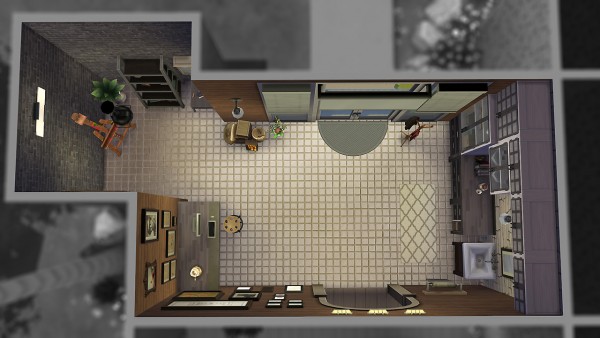
This screenshot has width=600, height=338. Find the location of `living space`. living space is located at coordinates (157, 243).